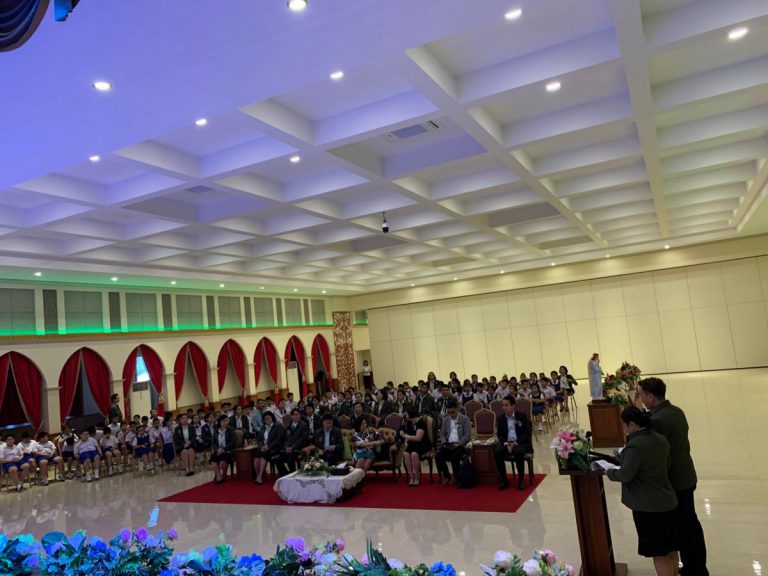
Find the location of a particular element. The height and width of the screenshot is (576, 768). shiny flooring is located at coordinates (233, 529).